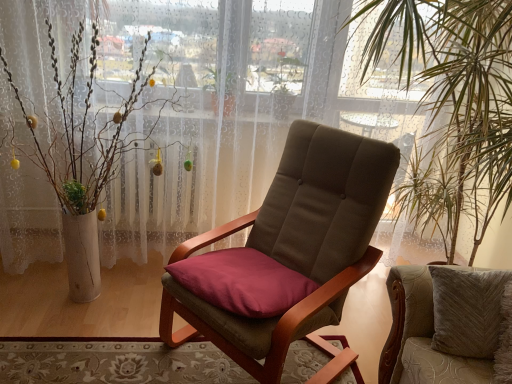
Question: Is the position of carpeted rug at lower left less distant than that of brown fabric chair at center, the first chair in the left-to-right sequence?

Choices:
 (A) no
 (B) yes

Answer: (A)

Question: Is carpeted rug at lower left positioned far away from brown fabric chair at center, which is the 2th chair in right-to-left order?

Choices:
 (A) no
 (B) yes

Answer: (A)

Question: Can you confirm if carpeted rug at lower left is thinner than brown fabric chair at center, which is the 2th chair in right-to-left order?

Choices:
 (A) yes
 (B) no

Answer: (B)

Question: Is carpeted rug at lower left to the left of brown fabric chair at center, which is the 2th chair in right-to-left order, from the viewer's perspective?

Choices:
 (A) yes
 (B) no

Answer: (A)

Question: Does carpeted rug at lower left lie behind brown fabric chair at center, the first chair in the left-to-right sequence?

Choices:
 (A) no
 (B) yes

Answer: (B)

Question: Is point (464, 379) closer or farther from the camera than point (499, 26)?

Choices:
 (A) closer
 (B) farther

Answer: (A)

Question: From a real-world perspective, is velvet beige cushion at center, the 2th chair positioned from the left, above or below green leafy plant at right?

Choices:
 (A) below
 (B) above

Answer: (A)

Question: Is velvet beige cushion at center, the 2th chair positioned from the left, situated inside green leafy plant at right or outside?

Choices:
 (A) outside
 (B) inside

Answer: (A)

Question: From the image's perspective, relative to green leafy plant at right, is velvet beige cushion at center, positioned as the first chair in right-to-left order, above or below?

Choices:
 (A) below
 (B) above

Answer: (A)

Question: From a real-world perspective, is carpeted rug at lower left above or below green leafy plant at right?

Choices:
 (A) below
 (B) above

Answer: (A)

Question: From the image's perspective, is carpeted rug at lower left positioned above or below green leafy plant at right?

Choices:
 (A) above
 (B) below

Answer: (B)

Question: Based on their positions, is carpeted rug at lower left located to the left or right of green leafy plant at right?

Choices:
 (A) right
 (B) left

Answer: (B)

Question: Is carpeted rug at lower left spatially inside green leafy plant at right, or outside of it?

Choices:
 (A) inside
 (B) outside

Answer: (B)

Question: Is green leafy plant at right wider or thinner than carpeted rug at lower left?

Choices:
 (A) thin
 (B) wide

Answer: (A)

Question: In the image, is green leafy plant at right positioned in front of or behind carpeted rug at lower left?

Choices:
 (A) behind
 (B) front

Answer: (B)